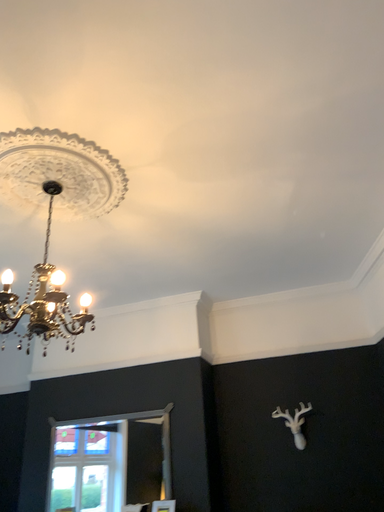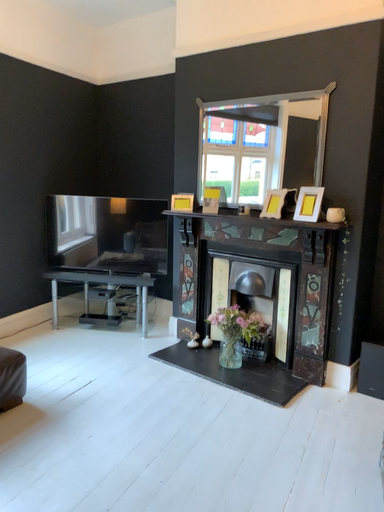
Question: Which way did the camera rotate in the video?

Choices:
 (A) rotated left
 (B) rotated right

Answer: (A)